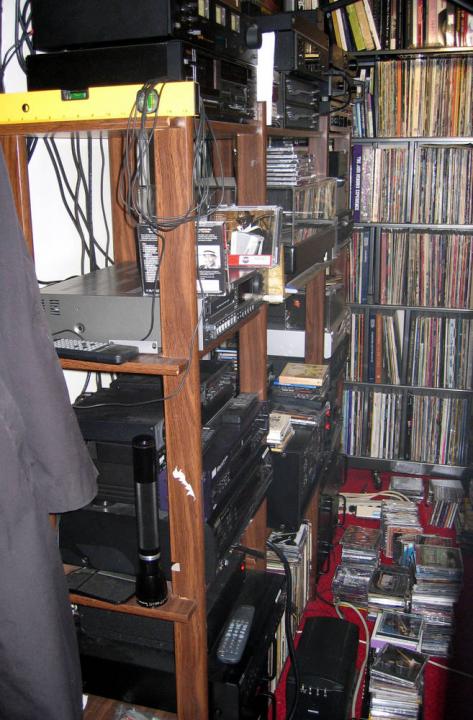
I want to click on remotes, so click(242, 631), click(117, 350), click(240, 400), click(207, 433).